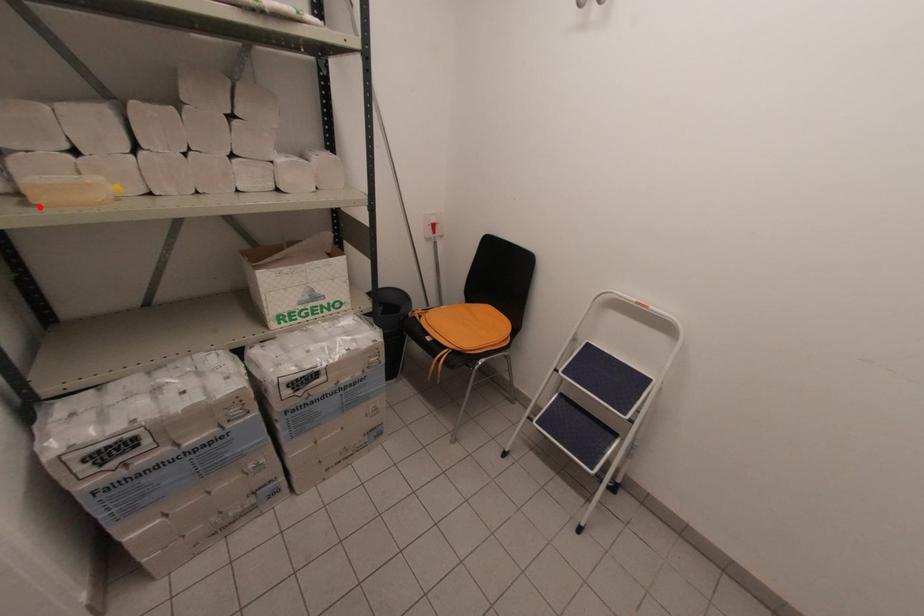
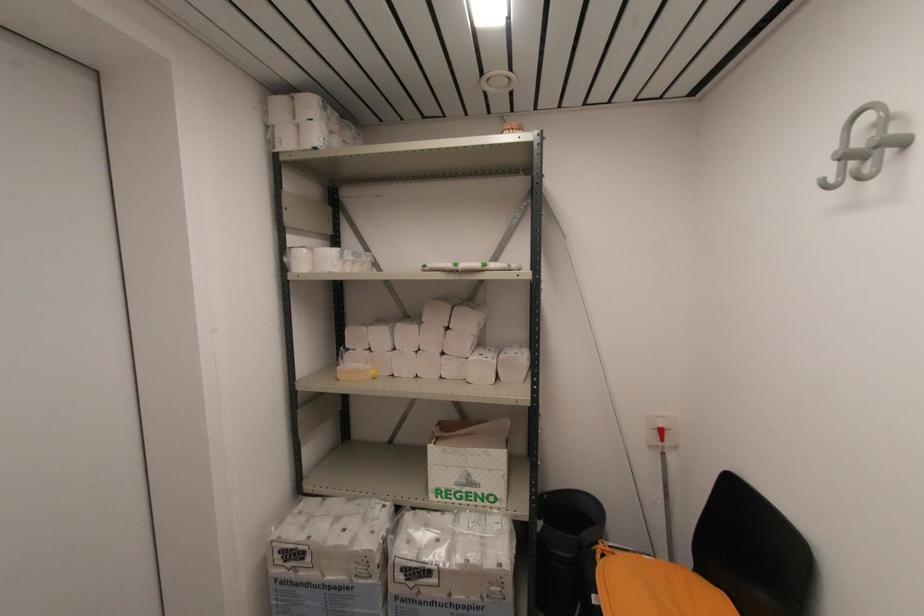
In the second image, find the point that corresponds to the highlighted location in the first image.

(339, 381)